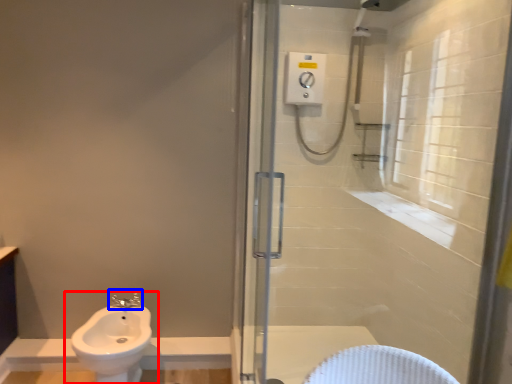
Question: Which of the following is the farthest to the observer, sink (highlighted by a red box) or tap (highlighted by a blue box)?

Choices:
 (A) sink
 (B) tap

Answer: (B)